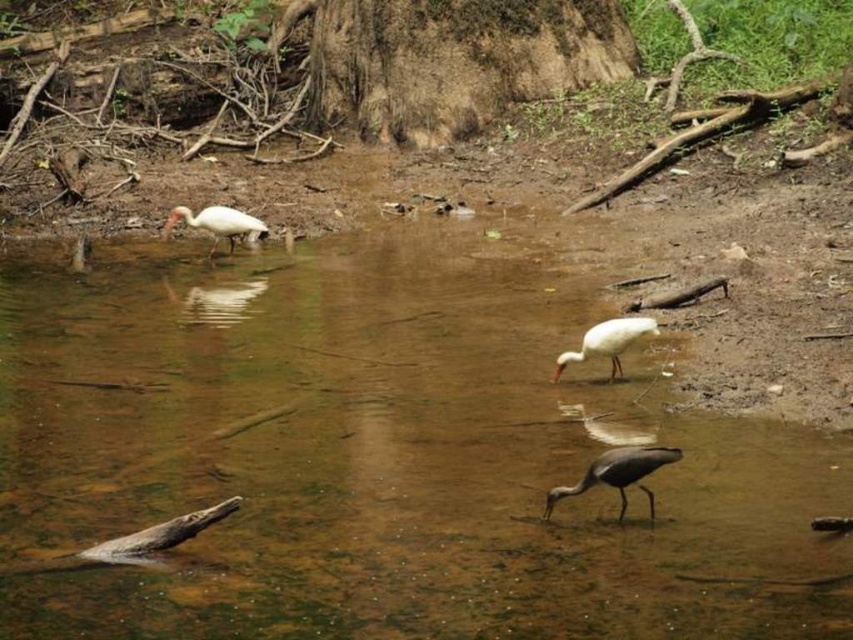
You are a birdwatcher observing the scene from the shore. You notice two birds in the image. Which one is closer to you, the white matte bird at center or the white glossy bird at upper left?

The white matte bird at center is closer to you because it is positioned in front of the white glossy bird at upper left.

You are an ornithologist observing two white birds in the stream area. You notice a white matte bird at center and a white glossy bird at upper left. Which of these two birds appears to take up more visual space in the image?

The white glossy bird at upper left occupies more visual space than the white matte bird at center.